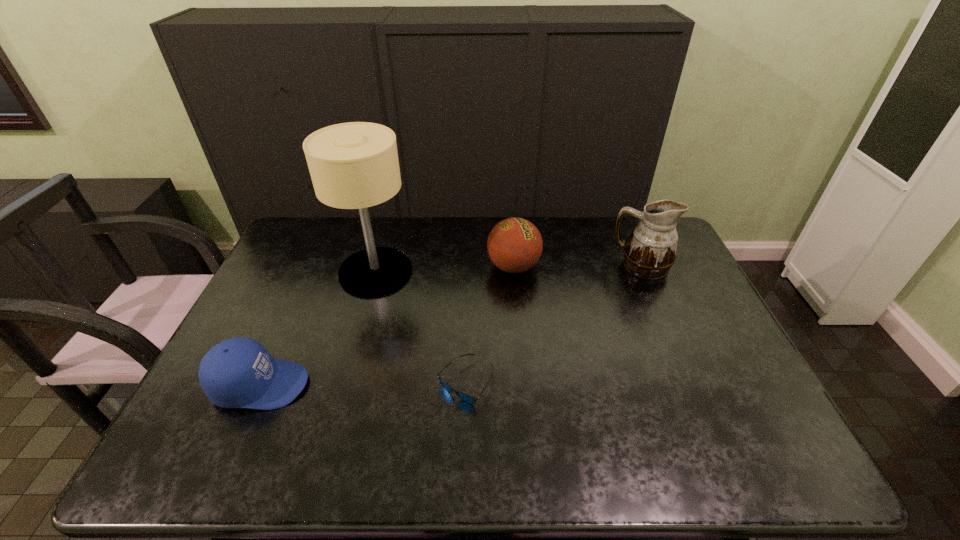
Locate an element on the screen. vacant space at the near edge of the desktop is located at coordinates (504, 451).

In the image, there is a desktop. Identify the location of vacant space at the left edge. The height and width of the screenshot is (540, 960). (250, 434).

At what (x,y) coordinates should I click in order to perform the action: click on vacant space at the near left corner of the desktop. Please return your answer as a coordinate pair (x, y). The width and height of the screenshot is (960, 540). Looking at the image, I should click on (224, 446).

Find the location of a particular element. The image size is (960, 540). free space at the near right corner of the desktop is located at coordinates (728, 455).

The height and width of the screenshot is (540, 960). What are the coordinates of `vacant area between the basketball and the second shortest object` in the screenshot? It's located at (387, 326).

At what (x,y) coordinates should I click in order to perform the action: click on free space between the second tallest object and the cap. Please return your answer as a coordinate pair (x, y). This screenshot has height=540, width=960. Looking at the image, I should click on coord(451,326).

Identify the location of free spot between the cap and the tallest object. This screenshot has height=540, width=960. (318, 328).

At what (x,y) coordinates should I click in order to perform the action: click on free space between the table lamp and the basketball. Please return your answer as a coordinate pair (x, y). Looking at the image, I should click on (444, 269).

Locate an element on the screen. The image size is (960, 540). vacant area that lies between the basketball and the fourth shortest object is located at coordinates (578, 266).

What are the coordinates of `free space between the cap and the basketball` in the screenshot? It's located at (387, 326).